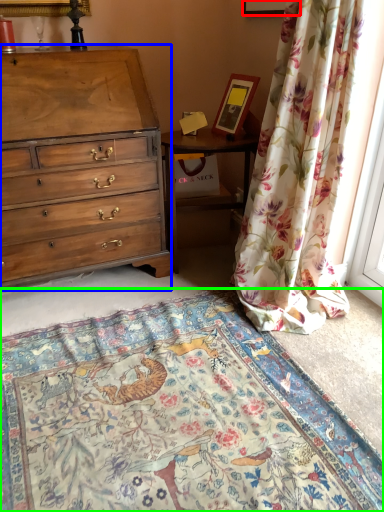
Question: Which is nearer to the picture frame (highlighted by a red box)? chest of drawers (highlighted by a blue box) or mat (highlighted by a green box).

Choices:
 (A) chest of drawers
 (B) mat

Answer: (A)